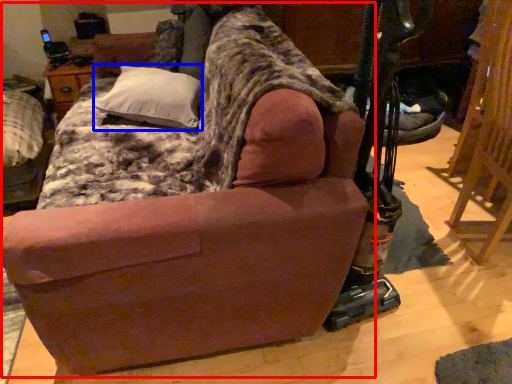
Question: Which of the following is the closest to the observer, studio couch (highlighted by a red box) or pillow (highlighted by a blue box)?

Choices:
 (A) studio couch
 (B) pillow

Answer: (A)